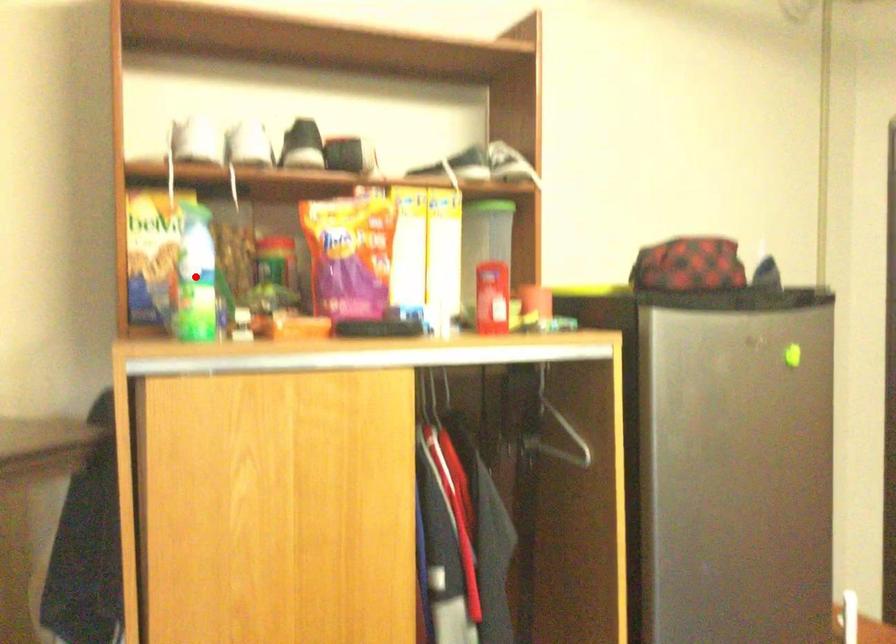
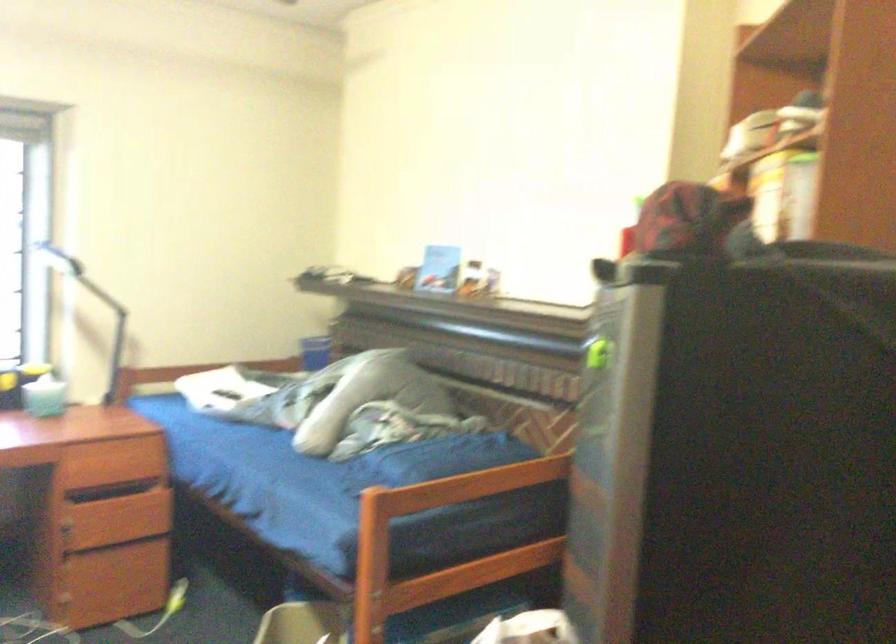
Question: I am providing you with two images of the same scene from different viewpoints. A red point is marked on the first image. Can you still see the location of the red point in image 2?

Choices:
 (A) Yes
 (B) No

Answer: (B)